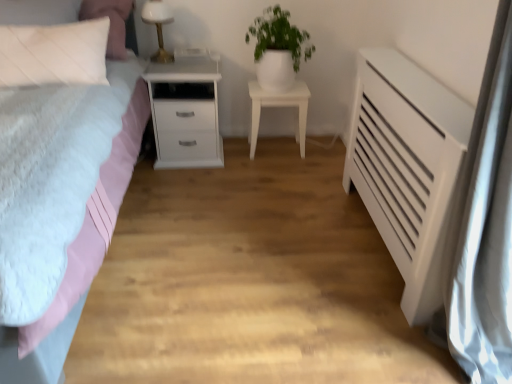
Question: Considering the relative positions of white glossy table lamp at upper center and white matte radiator at right in the image provided, is white glossy table lamp at upper center behind white matte radiator at right?

Choices:
 (A) no
 (B) yes

Answer: (B)

Question: Is white glossy table lamp at upper center to the right of white matte radiator at right from the viewer's perspective?

Choices:
 (A) yes
 (B) no

Answer: (B)

Question: Can you confirm if white glossy table lamp at upper center is smaller than white matte radiator at right?

Choices:
 (A) yes
 (B) no

Answer: (A)

Question: Could you tell me if white glossy table lamp at upper center is turned towards white matte radiator at right?

Choices:
 (A) yes
 (B) no

Answer: (B)

Question: Is the position of white glossy table lamp at upper center less distant than that of white matte radiator at right?

Choices:
 (A) no
 (B) yes

Answer: (A)

Question: Does white glossy table lamp at upper center have a greater width compared to white matte radiator at right?

Choices:
 (A) yes
 (B) no

Answer: (B)

Question: Considering the relative positions of matte pink bed at left and white quilted pillow at upper left in the image provided, is matte pink bed at left behind white quilted pillow at upper left?

Choices:
 (A) yes
 (B) no

Answer: (B)

Question: From the image's perspective, does matte pink bed at left appear lower than white quilted pillow at upper left?

Choices:
 (A) yes
 (B) no

Answer: (A)

Question: Considering the relative sizes of matte pink bed at left and white quilted pillow at upper left in the image provided, is matte pink bed at left bigger than white quilted pillow at upper left?

Choices:
 (A) no
 (B) yes

Answer: (B)

Question: Does matte pink bed at left have a smaller size compared to white quilted pillow at upper left?

Choices:
 (A) yes
 (B) no

Answer: (B)

Question: Is matte pink bed at left taller than white quilted pillow at upper left?

Choices:
 (A) yes
 (B) no

Answer: (A)

Question: Considering the relative sizes of matte pink bed at left and white quilted pillow at upper left in the image provided, is matte pink bed at left thinner than white quilted pillow at upper left?

Choices:
 (A) yes
 (B) no

Answer: (B)

Question: Can we say white glossy nightstand at center, marked as the 1th nightstand in a right-to-left arrangement, lies outside white glossy pot at upper center?

Choices:
 (A) yes
 (B) no

Answer: (A)